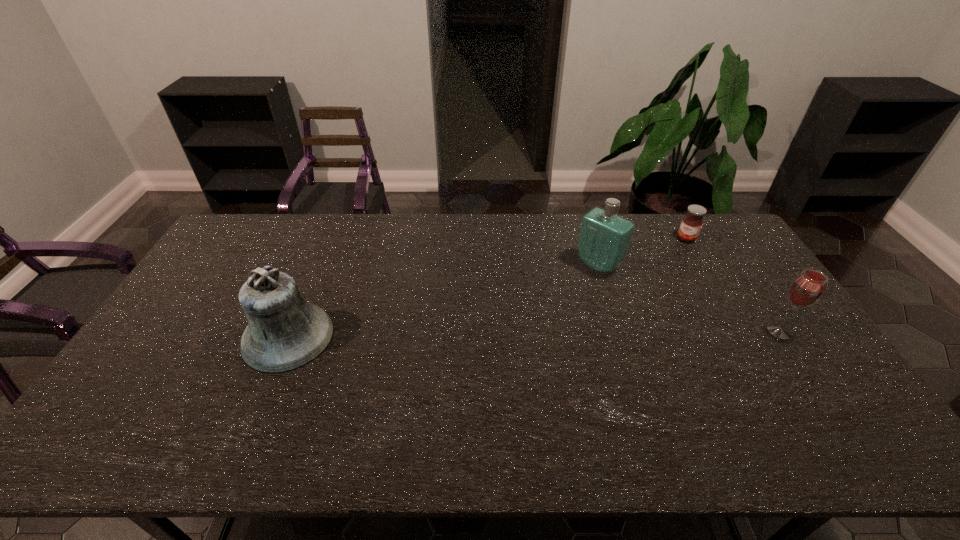
Identify the location of bell. The image size is (960, 540). point(285,332).

Find the location of `the rightmost object`. the rightmost object is located at coordinates (806, 289).

In order to click on wineglass in this screenshot , I will do pyautogui.click(x=806, y=289).

Where is `the third object from right to left`? The width and height of the screenshot is (960, 540). the third object from right to left is located at coordinates (604, 239).

Image resolution: width=960 pixels, height=540 pixels. Find the location of `perfume`. perfume is located at coordinates (604, 239).

Find the location of a particular element. the shortest object is located at coordinates (692, 222).

Find the location of a particular element. This screenshot has height=540, width=960. the third object from left to right is located at coordinates (692, 222).

Image resolution: width=960 pixels, height=540 pixels. In order to click on blank space located 0.110m on the left of the bell in this screenshot , I will do `click(205, 337)`.

Identify the location of free space located 0.230m on the back of the second shortest object. The image size is (960, 540). (739, 269).

You are a GUI agent. You are given a task and a screenshot of the screen. Output one action in this format:
    pyautogui.click(x=<x>, y=<y>)
    Task: Click on the vacant region located 0.150m on the front label of the third object from right to left
    
    Given the screenshot: What is the action you would take?
    pyautogui.click(x=559, y=300)